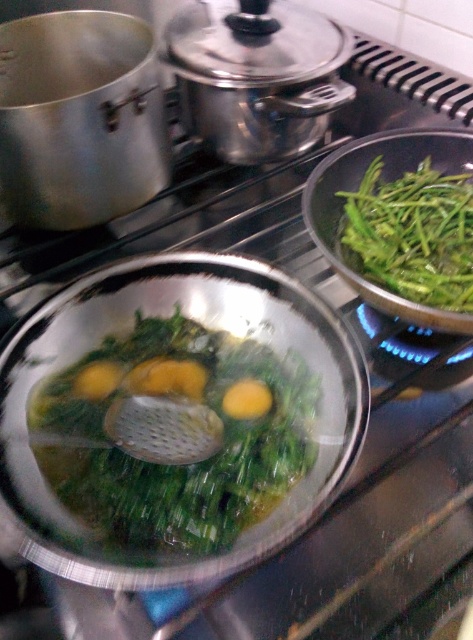
Looking at this image, you are a chef preparing a dish and need to move the green leafy vegetables at center to the right side of the green leafy vegetable at right. Is this possible based on their current positions?

The green leafy vegetables at center is already positioned on the left side of green leafy vegetable at right, so moving it further to the right would place it next to or beyond the existing green leafy vegetable at right. However, since the question specifies moving it to the right side of the green leafy vegetable at right, this would require space that may not exist based on the current arrangement. The answer depends on available space not described here, but according to the given information, the move

You are a chef preparing a dish and need to transfer the green leafy vegetables at center to the green leafy vegetable at right. Can you do this without moving the pans?

The green leafy vegetables at center and green leafy vegetable at right are 10.08 inches apart from each other. Since the distance is more than the typical utensil reach, you would need to move the pans closer or use a longer tool to transfer them.

You are a chef preparing a dish and need to locate the green leafy vegetables at center. According to the coordinates provided, where exactly are they positioned in the image?

The green leafy vegetables at center are positioned at coordinates point [166,458].